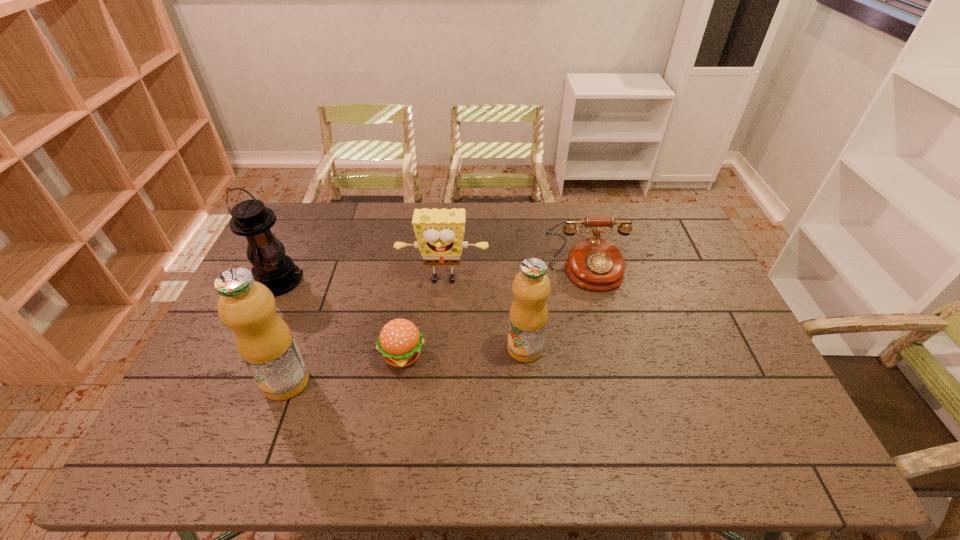
Find several locations within the vacant space located above the lantern, indicating its light source. Please provide its 2D coordinates. Your answer should be formatted as a tuple, i.e. [(x, y)], where the tuple contains the x and y coordinates of a point satisfying the conditions above.

[(333, 281)]

You are a GUI agent. You are given a task and a screenshot of the screen. Output one action in this format:
    pyautogui.click(x=<x>, y=<y>)
    Task: Click on the vacant space located 0.180m on the dial of the telephone
    This screenshot has width=960, height=540.
    Given the screenshot: What is the action you would take?
    pyautogui.click(x=603, y=338)

Find the location of a particular element. This screenshot has width=960, height=540. free space located 0.120m on the right of the hamburger is located at coordinates (469, 355).

You are a GUI agent. You are given a task and a screenshot of the screen. Output one action in this format:
    pyautogui.click(x=<x>, y=<y>)
    Task: Click on the object present at the near edge
    
    Given the screenshot: What is the action you would take?
    pyautogui.click(x=263, y=339)

Locate an element on the screen. object that is at the left edge is located at coordinates (250, 218).

What are the coordinates of `vacant area at the far edge of the desktop` in the screenshot? It's located at (389, 211).

In the image, there is a desktop. Find the location of `vacant space at the near edge`. vacant space at the near edge is located at coordinates (628, 394).

The image size is (960, 540). Identify the location of vacant space at the left edge of the desktop. 229,343.

At what (x,y) coordinates should I click in order to perform the action: click on vacant area at the right edge. Please return your answer as a coordinate pair (x, y). The width and height of the screenshot is (960, 540). Looking at the image, I should click on (671, 268).

The width and height of the screenshot is (960, 540). Identify the location of vacant space at the far left corner of the desktop. (303, 230).